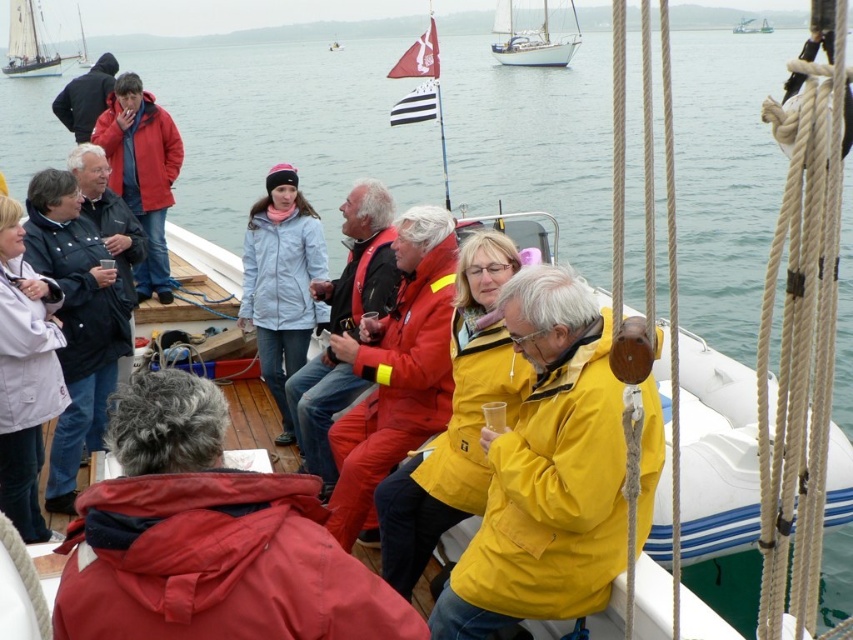
You are standing on the deck of the sailboat and want to hand a drink to the person wearing the red matte jacket at center and the matte red jacket at upper left. Which person is closer to you if you are facing the front of the boat?

The red matte jacket at center is located below the matte red jacket at upper left, so if you are facing the front of the boat, the red matte jacket at center is closer to you.

You are organizing a group photo on the sailboat and need to arrange two red items at the center of the deck. The red waterproof suit at center and the matte red jacket at center must be placed side by side. Given their widths, which item should be placed first to ensure they fit within the 1.2 meters available space?

The red waterproof suit at center has a smaller width than the matte red jacket at center. To fit both within the 1.2 meters space, place the wider matte red jacket at center first, then the narrower red waterproof suit at center next to it.

You are navigating a drone that needs to take a photo of the white glossy sailboat at upper center. The drone is currently at point A, which is at coordinates 0.0, 0.0. What direction should the drone move to reach the sailboat?

The white glossy sailboat at upper center is located at point (531, 40). Since the drone is at (0, 0), it should move upward and slightly to the right to reach the sailboat.